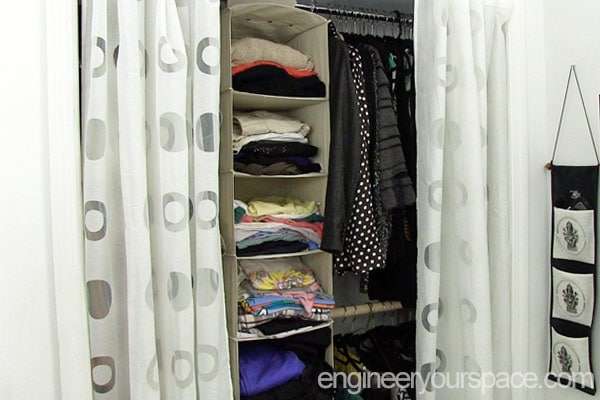
This screenshot has width=600, height=400. Find the location of `organizer shleves`. organizer shleves is located at coordinates (273, 95), (284, 173), (283, 256), (306, 329), (315, 395).